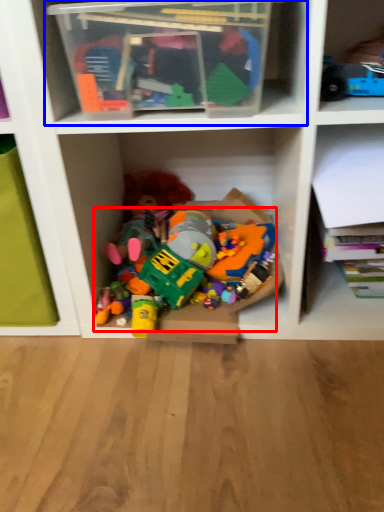
Question: Which point is closer to the camera, toy (highlighted by a red box) or shelf (highlighted by a blue box)?

Choices:
 (A) toy
 (B) shelf

Answer: (B)